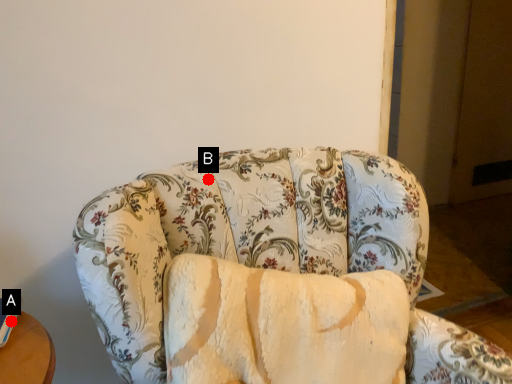
Question: Two points are circled on the image, labeled by A and B beside each circle. Which of the following is the farthest from the observer?

Choices:
 (A) A is further
 (B) B is further

Answer: (B)